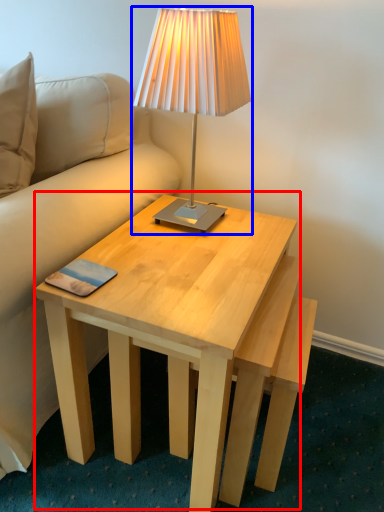
Question: Which object is closer to the camera taking this photo, coffee table (highlighted by a red box) or lamp (highlighted by a blue box)?

Choices:
 (A) coffee table
 (B) lamp

Answer: (A)